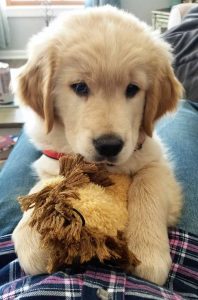
In order to click on light blue curtains in this screenshot , I will do `click(104, 1)`, `click(2, 34)`.